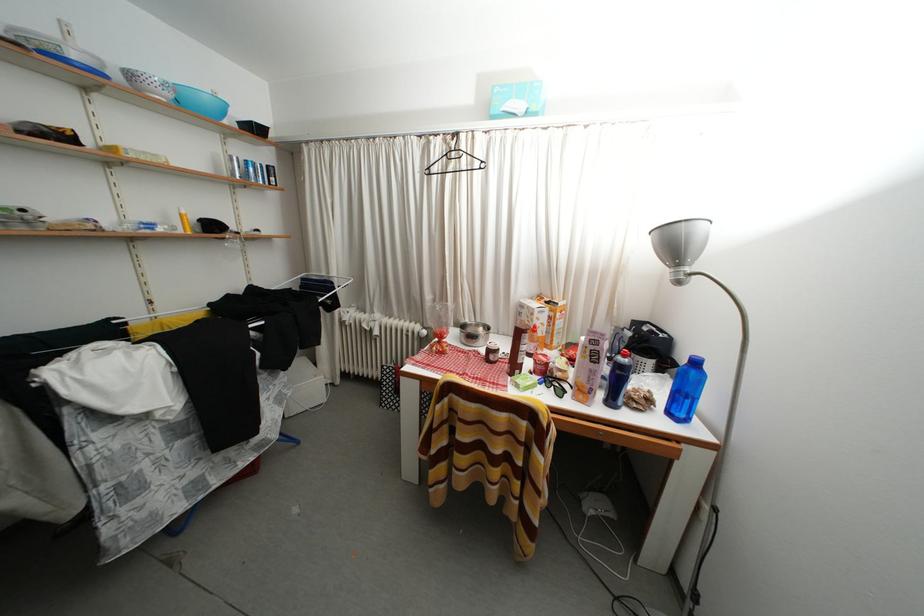
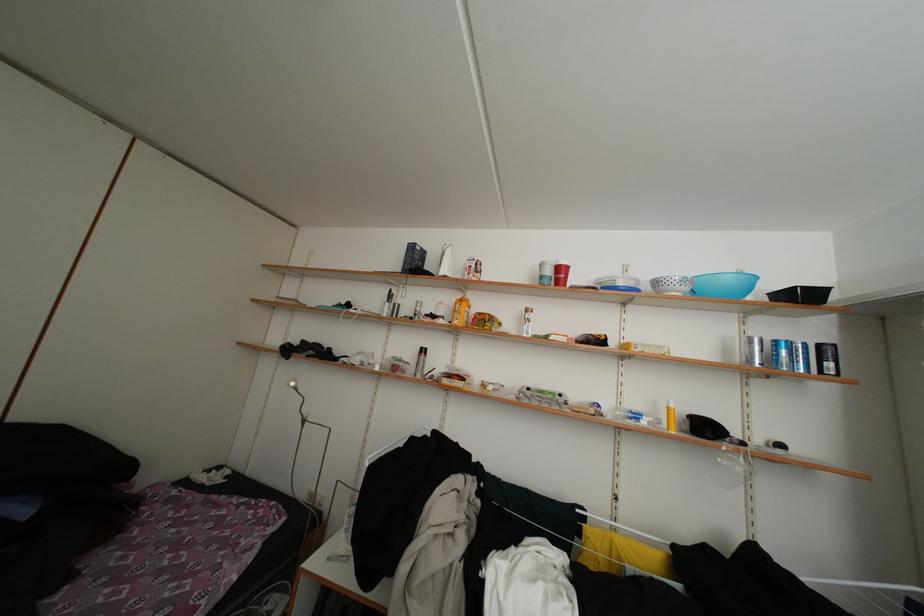
Question: The images are taken continuously from a first-person perspective. In which direction is your viewpoint rotating?

Choices:
 (A) Left
 (B) Right
 (C) Up
 (D) Down

Answer: (A)